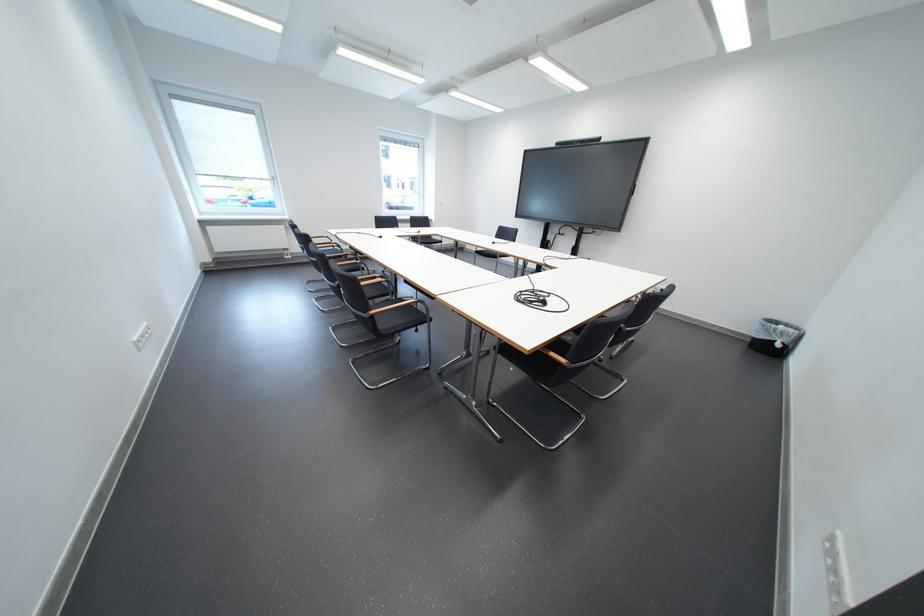
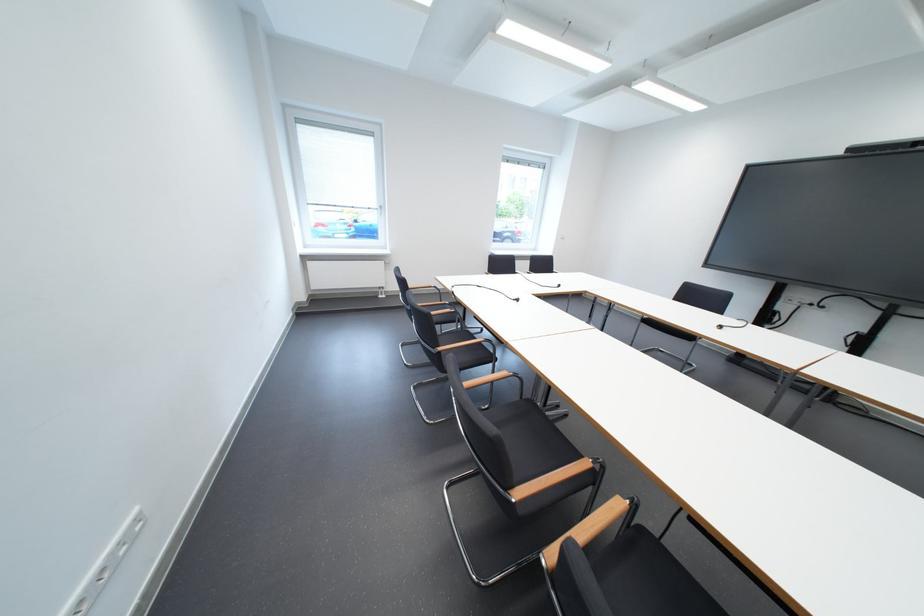
What movement of the cameraman would produce the second image?

The cameraman moved toward left, forward.